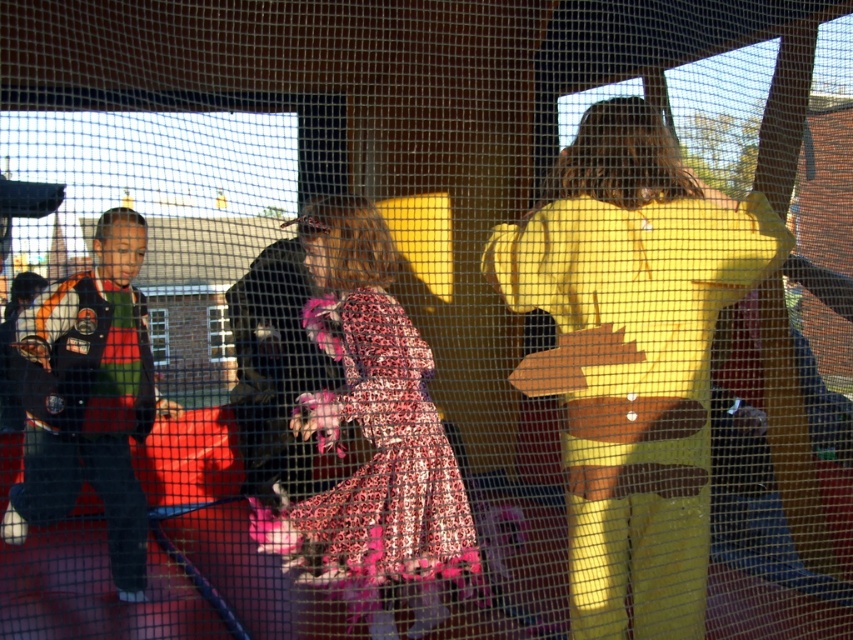
You are a parent trying to locate your child wearing a leopard print dress at center in a play area enclosed by a netted fence. There is also a child in a matte black vest at left. How far apart are the two children?

The leopard print dress at center is 98.69 centimeters from matte black vest at left.

You are a photographer trying to capture a clear shot of the leopard print dress at center through the netted fence. Given that the netting is spaced 10 cm apart, what is the minimum distance you should stand from the fence to ensure the dress remains fully visible without any obstruction from the netting?

To ensure the leopard print dress at center remains fully visible without obstruction from the netting spaced 10 cm apart, you should stand at least 1 meter away from the fence. This distance allows the netting gaps to appear small enough relative to the dress, minimizing visual interference.

You are a photographer trying to capture the leopard print dress at center in the image. The netted fence is obstructing your view. To get a clearer shot, you decide to move closer to the point marked at coordinates point (372, 436). However, you can only move in a straight line from your current position. Is the leopard print dress at center directly along this path?

The point (372, 436) marks the leopard print dress at center, so moving straight towards this coordinate will directly lead you to the leopard print dress at center, allowing for a clearer shot without needing to adjust direction.